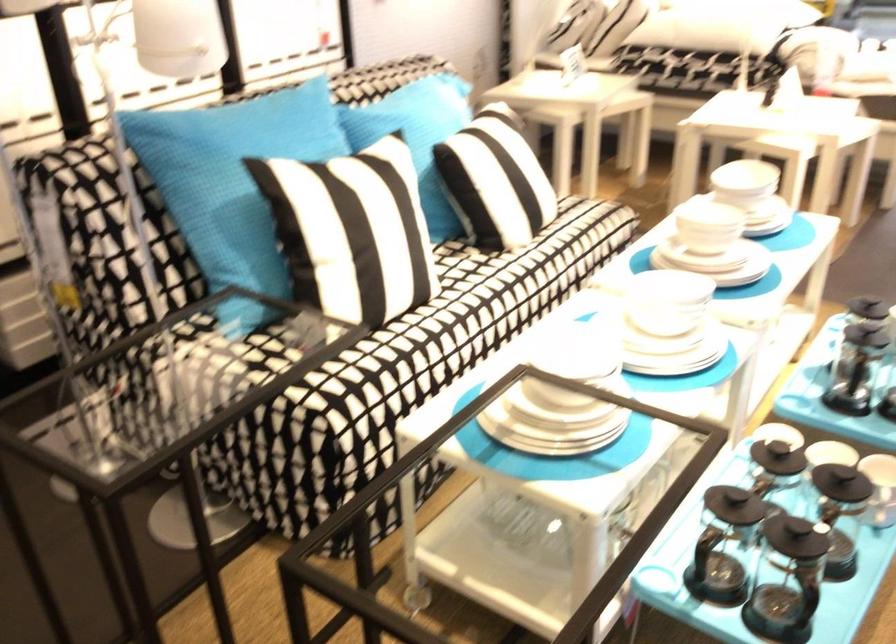
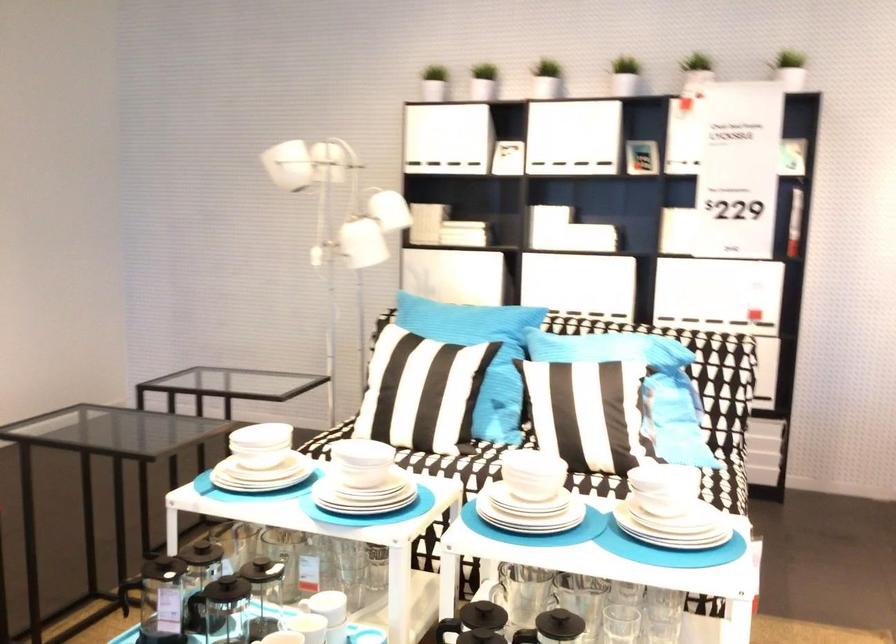
Find the pixel in the second image that matches (x=529, y=172) in the first image.

(583, 404)